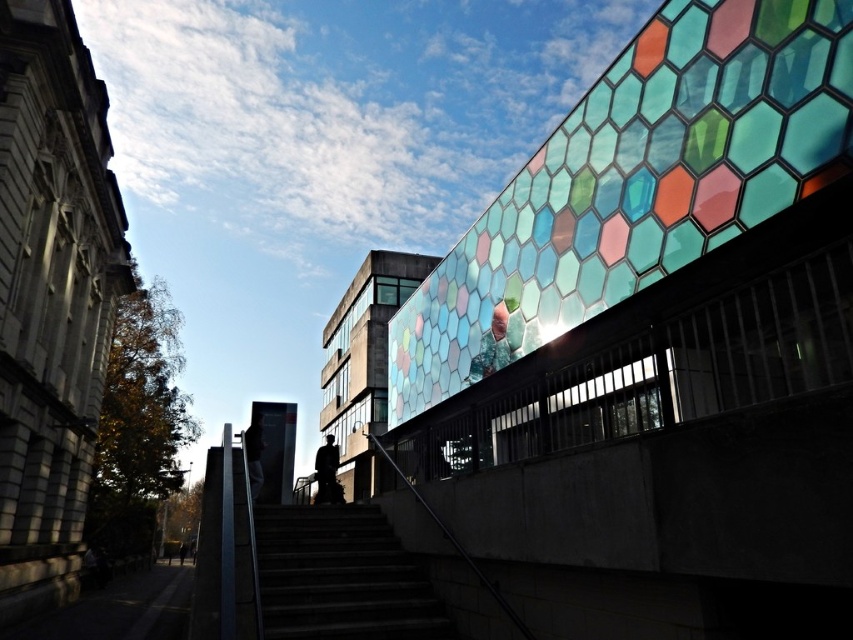
Question: Is multicolored hexagonal glass at upper right to the left of dark concrete stairs at center from the viewer's perspective?

Choices:
 (A) no
 (B) yes

Answer: (A)

Question: Is multicolored hexagonal glass at upper right to the right of dark concrete stairs at center from the viewer's perspective?

Choices:
 (A) yes
 (B) no

Answer: (A)

Question: Can you confirm if multicolored hexagonal glass at upper right is wider than dark concrete stairs at center?

Choices:
 (A) yes
 (B) no

Answer: (A)

Question: Which point is farther to the camera?

Choices:
 (A) (753, 38)
 (B) (334, 600)

Answer: (B)